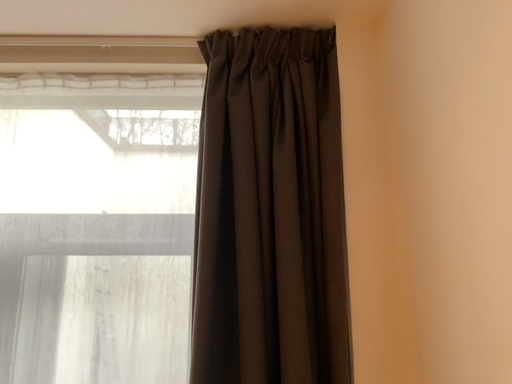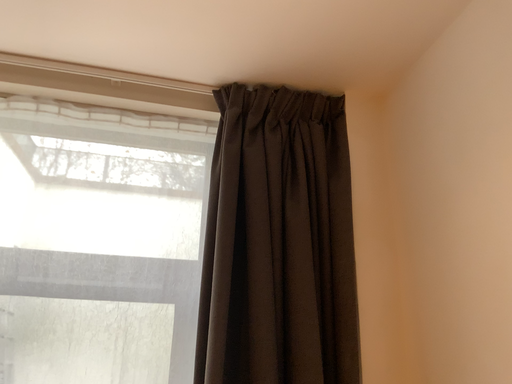
Question: Which way did the camera rotate in the video?

Choices:
 (A) rotated right
 (B) rotated left

Answer: (A)